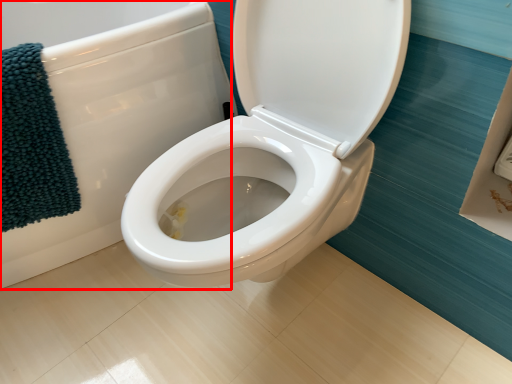
Question: From the image's perspective, where is bath (annotated by the red box) located relative to bath towel?

Choices:
 (A) below
 (B) above

Answer: (B)